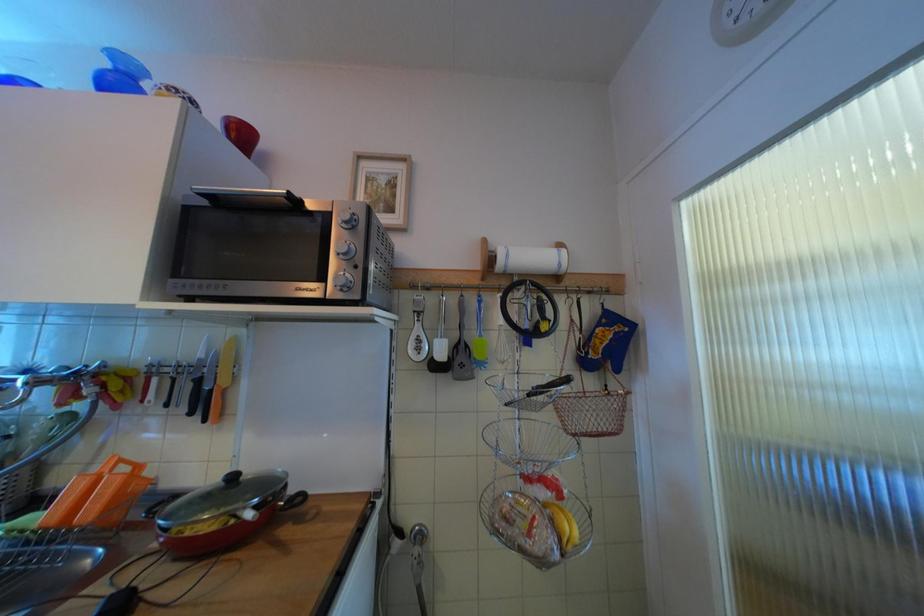
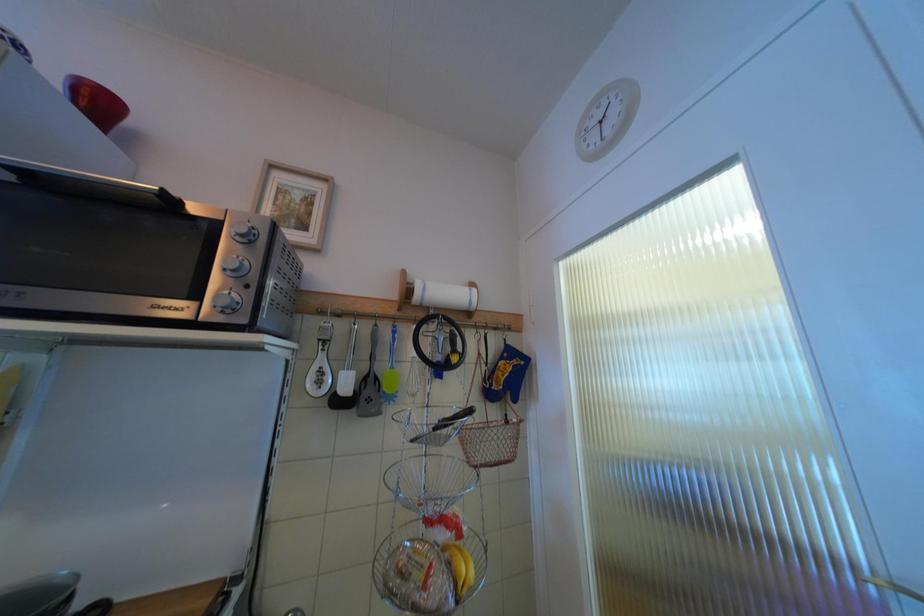
In a continuous first-person perspective shot, in which direction is the camera moving?

The cameraman walked toward right, backward.